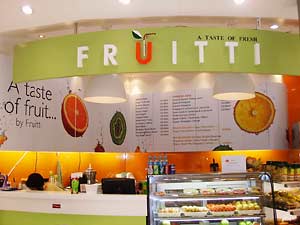
You are a GUI agent. You are given a task and a screenshot of the screen. Output one action in this format:
    pyautogui.click(x=<x>, y=<y>)
    Task: Click on the counter
    
    Given the screenshot: What is the action you would take?
    point(117,201)